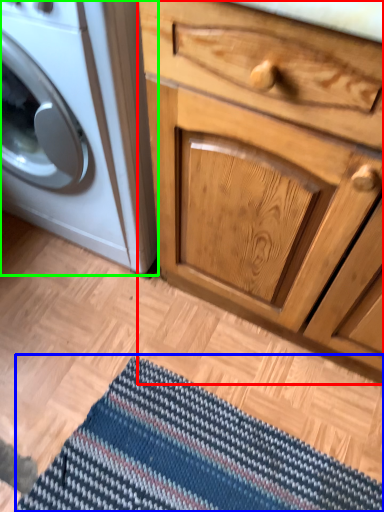
Question: Which object is positioned closest to chest of drawers (highlighted by a red box)? Select from doormat (highlighted by a blue box) and washing machine (highlighted by a green box).

Choices:
 (A) doormat
 (B) washing machine

Answer: (B)